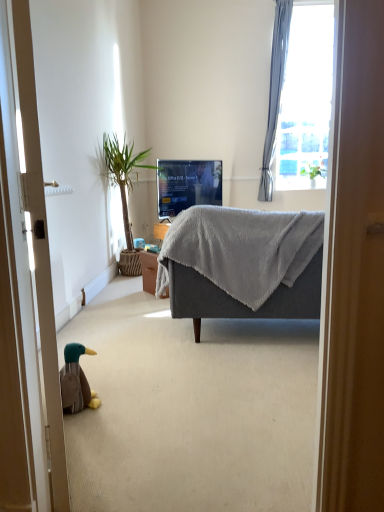
The height and width of the screenshot is (512, 384). I want to click on free space that is in between wooden door at left and brown plush duck at lower left, so click(91, 441).